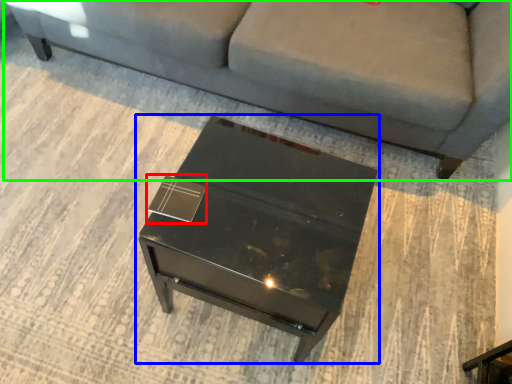
Question: Which is nearer to the square (highlighted by a red box)? table (highlighted by a blue box) or studio couch (highlighted by a green box).

Choices:
 (A) table
 (B) studio couch

Answer: (A)